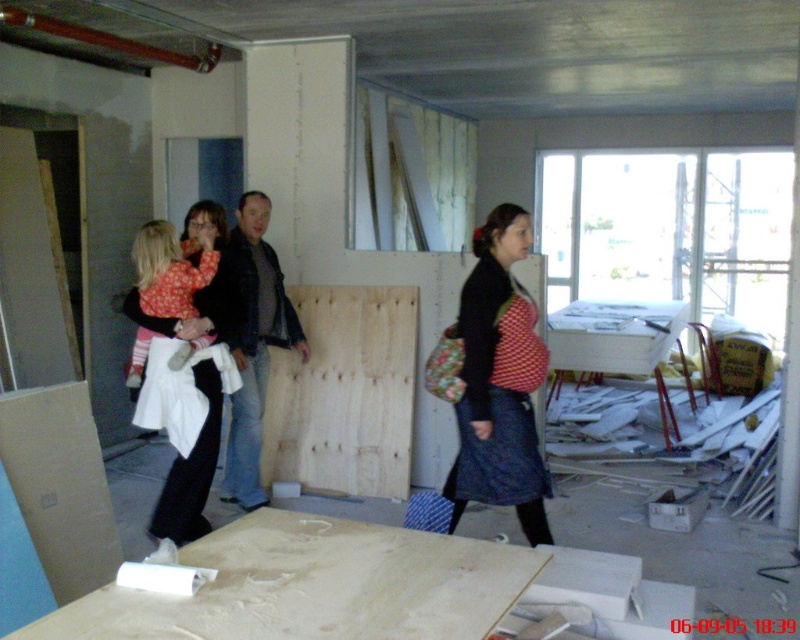
Based on the photo, you are standing in the construction site and see a point marked at coordinates [314,586]. What material is located at that point?

The point at coordinates [314,586] marks light brown smooth plywood at lower center.

You are standing at the point marked as point (344, 564) in a construction site with a high ceiling. You want to reach the door located at the opposite end of the room. The door is 7 feet away from your current position. Can you safely walk straight to the door without needing to detour around any obstacles?

The distance between you and the viewer is 6.76 feet, which is slightly less than the 7 feet to the door. Therefore, you can safely walk straight to the door without needing to detour around any obstacles.